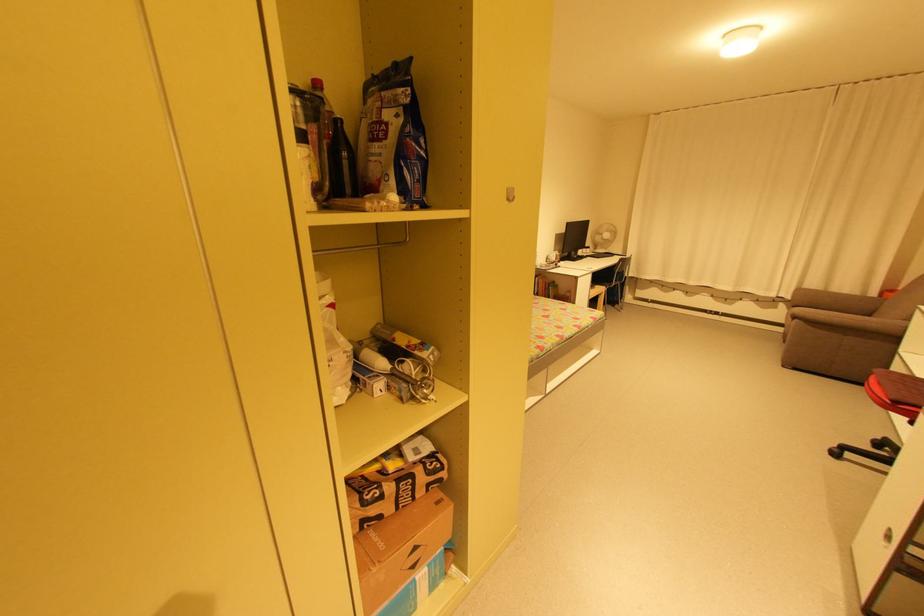
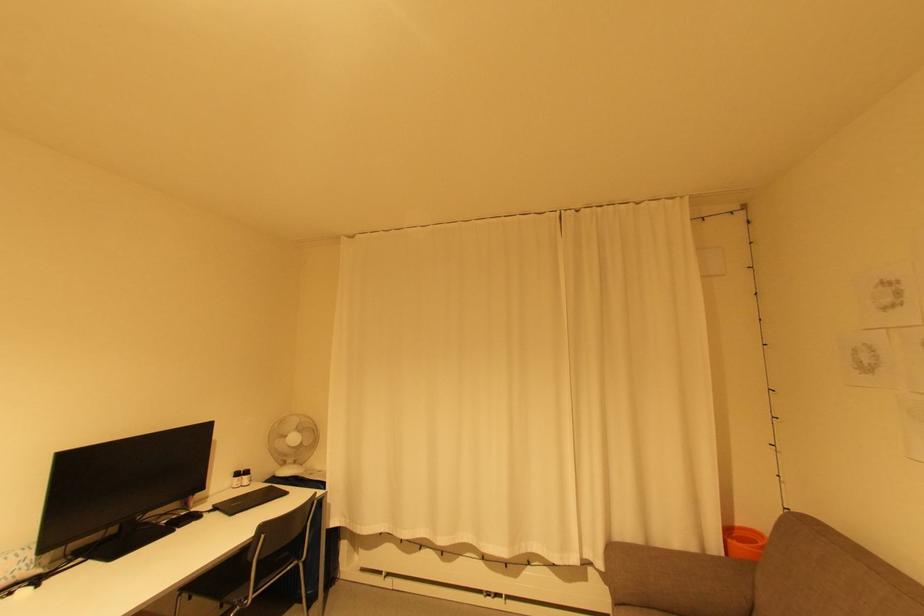
Find the pixel in the second image that matches (x=746, y=300) in the first image.

(533, 564)